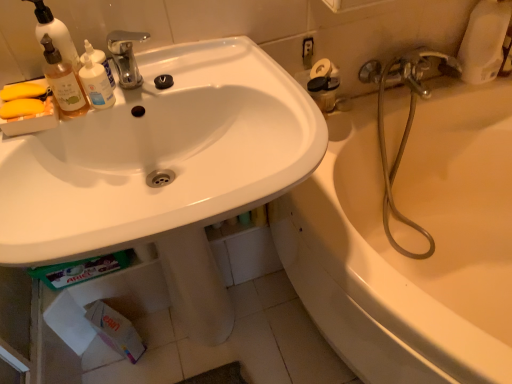
Where is `vacant area that lies to the right of polished chrome faucet at upper center`? The height and width of the screenshot is (384, 512). vacant area that lies to the right of polished chrome faucet at upper center is located at coordinates (218, 71).